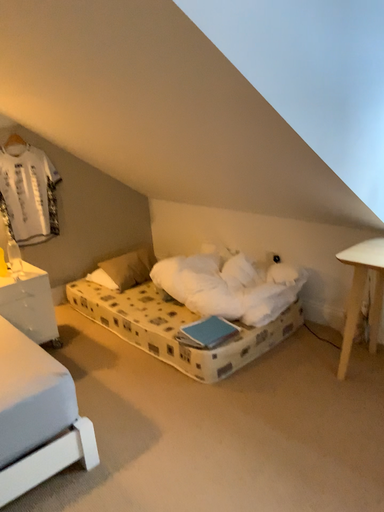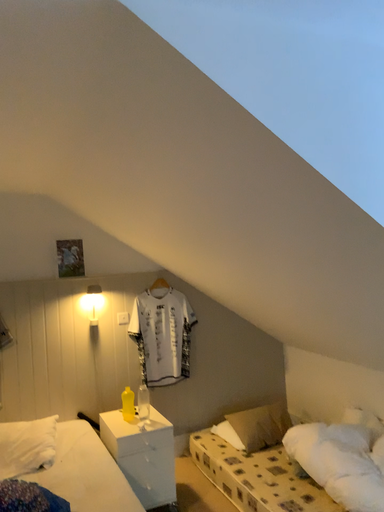
Question: Which way did the camera rotate in the video?

Choices:
 (A) rotated upward
 (B) rotated downward

Answer: (A)